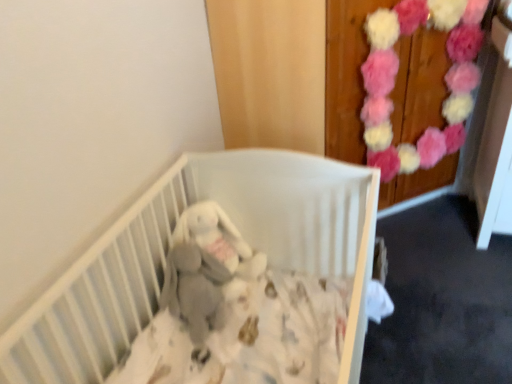
Question: Is puffy fabric flowers at upper right further to the viewer compared to gray plush baby elephant at center?

Choices:
 (A) yes
 (B) no

Answer: (A)

Question: Are puffy fabric flowers at upper right and gray plush baby elephant at center far apart?

Choices:
 (A) no
 (B) yes

Answer: (A)

Question: Is puffy fabric flowers at upper right smaller than gray plush baby elephant at center?

Choices:
 (A) yes
 (B) no

Answer: (B)

Question: Does puffy fabric flowers at upper right have a greater width compared to gray plush baby elephant at center?

Choices:
 (A) no
 (B) yes

Answer: (A)

Question: Is gray plush baby elephant at center surrounded by puffy fabric flowers at upper right?

Choices:
 (A) yes
 (B) no

Answer: (B)

Question: From the image's perspective, relative to gray plush baby elephant at center, is white matte crib at center above or below?

Choices:
 (A) above
 (B) below

Answer: (B)

Question: Is point (360, 347) positioned closer to the camera than point (190, 216)?

Choices:
 (A) farther
 (B) closer

Answer: (B)

Question: From a real-world perspective, relative to gray plush baby elephant at center, is white matte crib at center vertically above or below?

Choices:
 (A) above
 (B) below

Answer: (B)

Question: Relative to gray plush baby elephant at center, is white matte crib at center in front or behind?

Choices:
 (A) front
 (B) behind

Answer: (A)

Question: In terms of size, does white matte crib at center appear bigger or smaller than puffy fabric flowers at upper right?

Choices:
 (A) small
 (B) big

Answer: (B)

Question: From their relative heights in the image, would you say white matte crib at center is taller or shorter than puffy fabric flowers at upper right?

Choices:
 (A) short
 (B) tall

Answer: (A)

Question: Considering their positions, is white matte crib at center located in front of or behind puffy fabric flowers at upper right?

Choices:
 (A) front
 (B) behind

Answer: (A)

Question: Is point (119, 294) closer or farther from the camera than point (421, 1)?

Choices:
 (A) closer
 (B) farther

Answer: (A)

Question: Would you say gray plush baby elephant at center is to the left or to the right of puffy fabric flowers at upper right in the picture?

Choices:
 (A) left
 (B) right

Answer: (A)

Question: Is gray plush baby elephant at center bigger or smaller than puffy fabric flowers at upper right?

Choices:
 (A) small
 (B) big

Answer: (A)